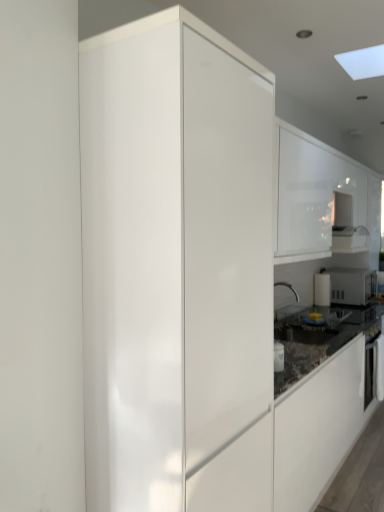
Question: Does black glossy oven at right have a lesser width compared to white glossy cabinet at upper right, which is the first cabinetry from right to left?

Choices:
 (A) yes
 (B) no

Answer: (A)

Question: Is black glossy oven at right positioned with its back to white glossy cabinet at upper right, arranged as the 2th cabinetry when viewed from the left?

Choices:
 (A) no
 (B) yes

Answer: (A)

Question: Is black glossy oven at right bigger than white glossy cabinet at upper right, which appears as the 2th cabinetry when viewed from the front?

Choices:
 (A) yes
 (B) no

Answer: (B)

Question: Can you confirm if black glossy oven at right is wider than white glossy cabinet at upper right, which appears as the 2th cabinetry when viewed from the front?

Choices:
 (A) yes
 (B) no

Answer: (B)

Question: From a real-world perspective, is black glossy oven at right located higher than white glossy cabinet at upper right, arranged as the 2th cabinetry when viewed from the left?

Choices:
 (A) yes
 (B) no

Answer: (B)

Question: Is point (336, 279) closer or farther from the camera than point (382, 373)?

Choices:
 (A) farther
 (B) closer

Answer: (A)

Question: Considering the positions of white glossy microwave at right and black glossy oven at right in the image, is white glossy microwave at right wider or thinner than black glossy oven at right?

Choices:
 (A) wide
 (B) thin

Answer: (A)

Question: Relative to black glossy oven at right, is white glossy microwave at right in front or behind?

Choices:
 (A) front
 (B) behind

Answer: (B)

Question: Would you say white glossy microwave at right is to the left or to the right of black glossy oven at right in the picture?

Choices:
 (A) left
 (B) right

Answer: (B)

Question: In the image, is white glossy microwave at right positioned in front of or behind glossy white cabinet at center, which is the first cabinetry in front-to-back order?

Choices:
 (A) front
 (B) behind

Answer: (B)

Question: From the image's perspective, is white glossy microwave at right located above or below glossy white cabinet at center, which is the first cabinetry in front-to-back order?

Choices:
 (A) below
 (B) above

Answer: (A)

Question: Looking at their shapes, would you say white glossy microwave at right is wider or thinner than glossy white cabinet at center, which is the first cabinetry in front-to-back order?

Choices:
 (A) wide
 (B) thin

Answer: (B)

Question: From their relative heights in the image, would you say white glossy microwave at right is taller or shorter than glossy white cabinet at center, which is the first cabinetry in front-to-back order?

Choices:
 (A) tall
 (B) short

Answer: (B)

Question: From the image's perspective, relative to white glossy microwave at right, is white glossy cabinet at upper right, arranged as the 1th cabinetry when viewed from the back, above or below?

Choices:
 (A) below
 (B) above

Answer: (B)

Question: From a real-world perspective, is white glossy cabinet at upper right, arranged as the 1th cabinetry when viewed from the back, physically located above or below white glossy microwave at right?

Choices:
 (A) below
 (B) above

Answer: (B)